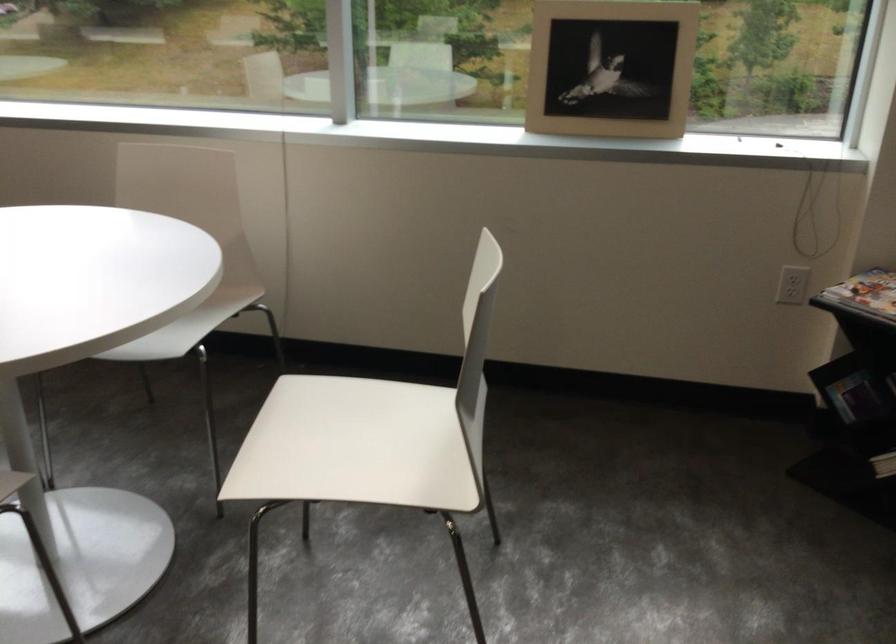
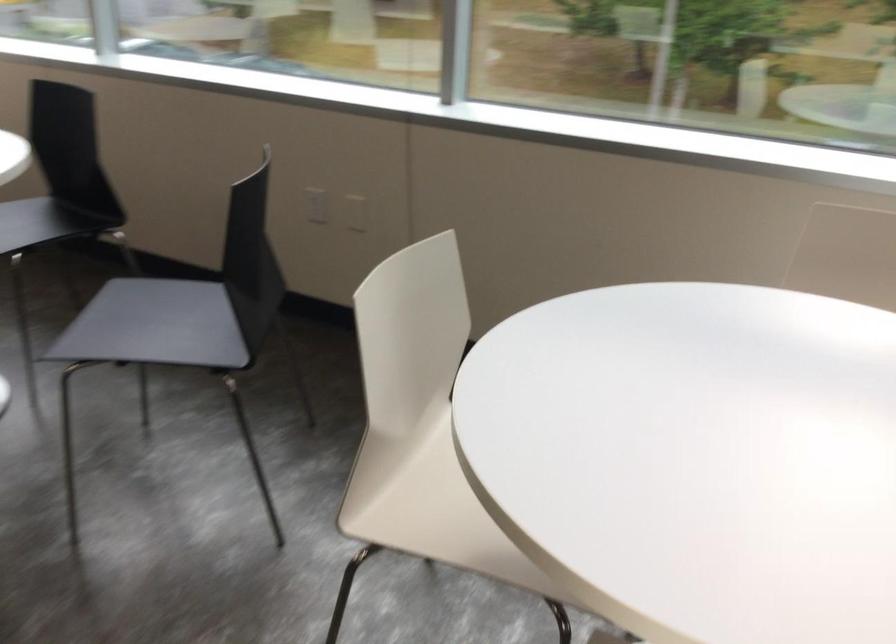
In a continuous first-person perspective shot, in which direction is the camera moving?

The cameraman moved toward left, forward.